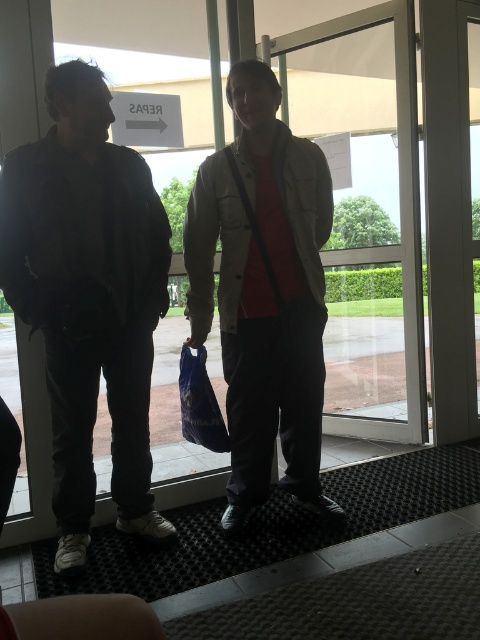
Question: Which object appears closest to the camera in this image?

Choices:
 (A) blue plastic bag at center
 (B) matte black jacket at left
 (C) light beige jacket at center
 (D) transparent glass door at center

Answer: (B)

Question: Does matte black jacket at left have a greater width compared to blue plastic bag at center?

Choices:
 (A) yes
 (B) no

Answer: (A)

Question: Which of the following is the closest to the observer?

Choices:
 (A) (300, 500)
 (B) (88, 353)
 (C) (181, 356)

Answer: (B)

Question: Which point is farther to the camera?

Choices:
 (A) transparent glass door at center
 (B) matte black jacket at left
 (C) blue plastic bag at center
 (D) light beige jacket at center

Answer: (A)

Question: Is light beige jacket at center smaller than transparent glass door at center?

Choices:
 (A) yes
 (B) no

Answer: (A)

Question: Can you confirm if light beige jacket at center is bigger than blue plastic bag at center?

Choices:
 (A) no
 (B) yes

Answer: (B)